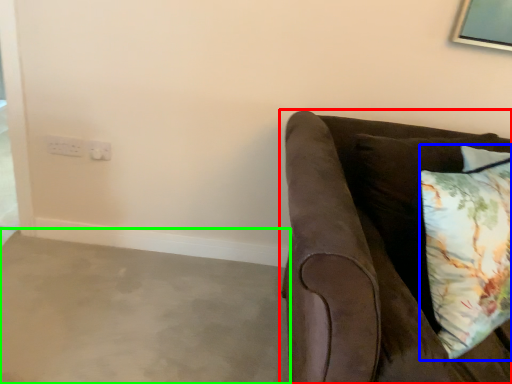
Question: Based on their relative distances, which object is farther from studio couch (highlighted by a red box)? Choose from pillow (highlighted by a blue box) and concrete (highlighted by a green box).

Choices:
 (A) pillow
 (B) concrete

Answer: (B)